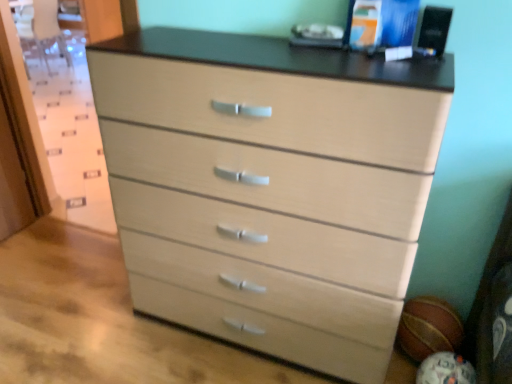
Question: Is light wood/texture chest of drawers at center shorter than matte brown basketball at lower right, the first basketball in the front-to-back sequence?

Choices:
 (A) no
 (B) yes

Answer: (A)

Question: Can you confirm if light wood/texture chest of drawers at center is positioned to the left of matte brown basketball at lower right, the 2th basketball positioned from the back?

Choices:
 (A) no
 (B) yes

Answer: (B)

Question: Does light wood/texture chest of drawers at center contain matte brown basketball at lower right, the first basketball in the front-to-back sequence?

Choices:
 (A) no
 (B) yes

Answer: (A)

Question: Could you tell me if light wood/texture chest of drawers at center is facing matte brown basketball at lower right, the first basketball in the front-to-back sequence?

Choices:
 (A) no
 (B) yes

Answer: (A)

Question: Is light wood/texture chest of drawers at center turned away from matte brown basketball at lower right, the first basketball in the front-to-back sequence?

Choices:
 (A) no
 (B) yes

Answer: (A)

Question: From a real-world perspective, is matte brown basketball at lower right, the 2th basketball positioned from the back, above or below light wood/texture chest of drawers at center?

Choices:
 (A) below
 (B) above

Answer: (A)

Question: From the image's perspective, is matte brown basketball at lower right, the first basketball in the front-to-back sequence, located above or below light wood/texture chest of drawers at center?

Choices:
 (A) above
 (B) below

Answer: (B)

Question: Is matte brown basketball at lower right, the 2th basketball positioned from the back, bigger or smaller than light wood/texture chest of drawers at center?

Choices:
 (A) small
 (B) big

Answer: (A)

Question: Considering the positions of matte brown basketball at lower right, the 2th basketball positioned from the back, and light wood/texture chest of drawers at center in the image, is matte brown basketball at lower right, the 2th basketball positioned from the back, wider or thinner than light wood/texture chest of drawers at center?

Choices:
 (A) wide
 (B) thin

Answer: (B)

Question: From the image's perspective, is rubber textured basketball at lower right, which is the first basketball from back to front, above or below light wood/texture chest of drawers at center?

Choices:
 (A) below
 (B) above

Answer: (A)

Question: From a real-world perspective, is rubber textured basketball at lower right, which is the first basketball from back to front, physically located above or below light wood/texture chest of drawers at center?

Choices:
 (A) below
 (B) above

Answer: (A)

Question: Relative to light wood/texture chest of drawers at center, is rubber textured basketball at lower right, which is the first basketball from back to front, in front or behind?

Choices:
 (A) front
 (B) behind

Answer: (B)

Question: Is point (428, 302) positioned closer to the camera than point (133, 127)?

Choices:
 (A) farther
 (B) closer

Answer: (A)

Question: From the image's perspective, is matte brown basketball at lower right, the 2th basketball positioned from the back, above or below rubber textured basketball at lower right, which is the first basketball from back to front?

Choices:
 (A) below
 (B) above

Answer: (A)

Question: Does point [432, 357] appear closer or farther from the camera than point [416, 329]?

Choices:
 (A) farther
 (B) closer

Answer: (B)